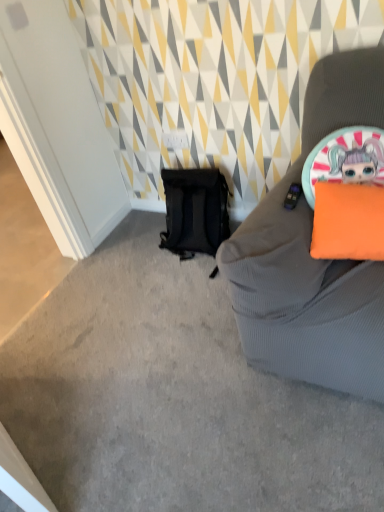
Question: Are black mesh backpack at lower left and orange fabric pillow at right located far from each other?

Choices:
 (A) no
 (B) yes

Answer: (A)

Question: From a real-world perspective, is black mesh backpack at lower left positioned over orange fabric pillow at right based on gravity?

Choices:
 (A) no
 (B) yes

Answer: (A)

Question: Considering the relative positions of black mesh backpack at lower left and orange fabric pillow at right in the image provided, is black mesh backpack at lower left to the left of orange fabric pillow at right from the viewer's perspective?

Choices:
 (A) yes
 (B) no

Answer: (A)

Question: Does black mesh backpack at lower left have a larger size compared to orange fabric pillow at right?

Choices:
 (A) yes
 (B) no

Answer: (A)

Question: Would you say orange fabric pillow at right is part of black mesh backpack at lower left's contents?

Choices:
 (A) no
 (B) yes

Answer: (A)

Question: From a real-world perspective, is black mesh backpack at lower left under orange fabric pillow at right?

Choices:
 (A) yes
 (B) no

Answer: (A)

Question: Is black mesh backpack at lower left a part of orange fabric pillow at right?

Choices:
 (A) yes
 (B) no

Answer: (B)

Question: Is orange fabric pillow at right bigger than black mesh backpack at lower left?

Choices:
 (A) yes
 (B) no

Answer: (B)

Question: Can you confirm if orange fabric pillow at right is wider than black mesh backpack at lower left?

Choices:
 (A) no
 (B) yes

Answer: (A)

Question: Could you tell me if orange fabric pillow at right is turned towards black mesh backpack at lower left?

Choices:
 (A) yes
 (B) no

Answer: (B)

Question: Considering the relative sizes of orange fabric pillow at right and black mesh backpack at lower left in the image provided, is orange fabric pillow at right shorter than black mesh backpack at lower left?

Choices:
 (A) yes
 (B) no

Answer: (A)

Question: Is orange fabric pillow at right thinner than black mesh backpack at lower left?

Choices:
 (A) no
 (B) yes

Answer: (B)

Question: From a real-world perspective, is orange fabric pillow at right positioned above or below black mesh backpack at lower left?

Choices:
 (A) above
 (B) below

Answer: (A)